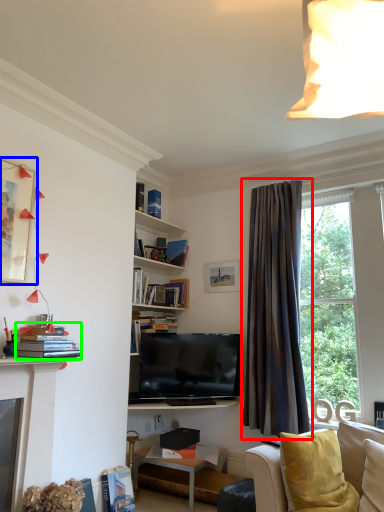
Question: Considering the real-world distances, which object is farthest from curtain (highlighted by a red box)? picture frame (highlighted by a blue box) or book (highlighted by a green box)?

Choices:
 (A) picture frame
 (B) book

Answer: (A)